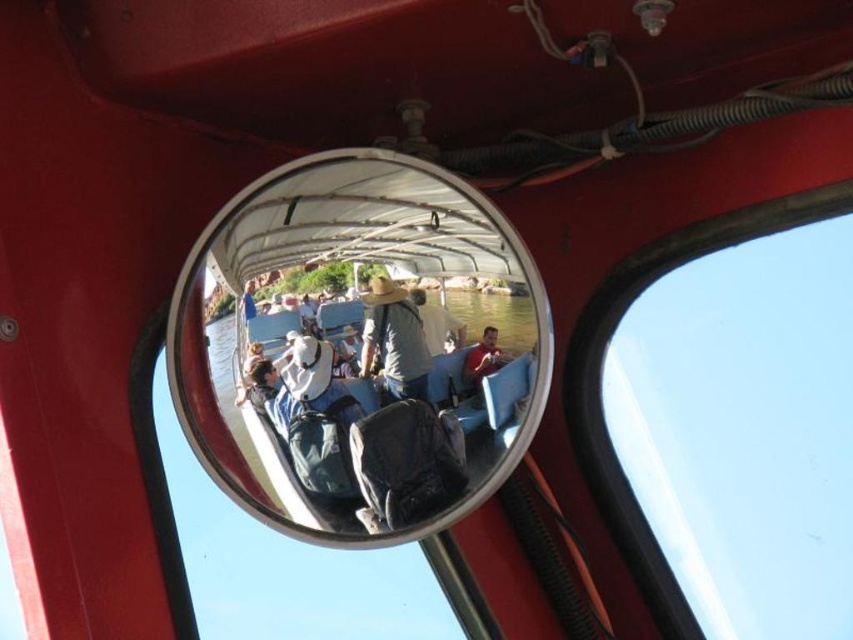
Question: Considering the real-world distances, which object is farthest from the light brown straw hat at center?

Choices:
 (A) matte gray shirt at center
 (B) metallic reflective mirror at center

Answer: (B)

Question: Is light brown straw hat at center thinner than matte gray shirt at center?

Choices:
 (A) no
 (B) yes

Answer: (A)

Question: Is metallic reflective mirror at center wider than light brown straw hat at center?

Choices:
 (A) no
 (B) yes

Answer: (B)

Question: Does light brown straw hat at center have a greater width compared to matte gray shirt at center?

Choices:
 (A) no
 (B) yes

Answer: (B)

Question: Which object is the farthest from the light brown straw hat at center?

Choices:
 (A) metallic reflective mirror at center
 (B) matte gray shirt at center

Answer: (A)

Question: Which point is farther from the camera taking this photo?

Choices:
 (A) (492, 340)
 (B) (364, 451)

Answer: (A)